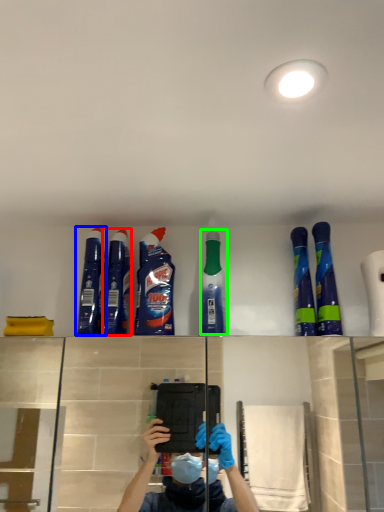
Question: Which object is the closest to the cleaning product (highlighted by a red box)? Choose among these: cleaning product (highlighted by a blue box) or cleaning product (highlighted by a green box).

Choices:
 (A) cleaning product
 (B) cleaning product

Answer: (A)